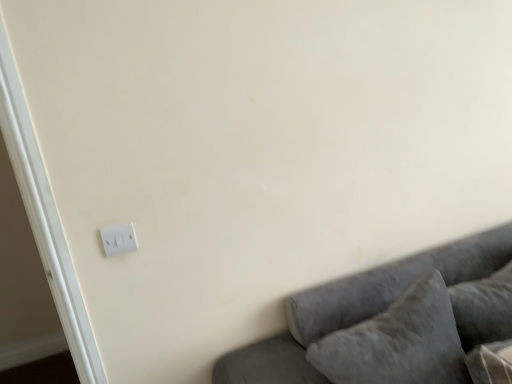
Question: Is velvety gray pillow at lower right, positioned as the second pillow in left-to-right order, in front of or behind white plastic light switch at lower left in the image?

Choices:
 (A) behind
 (B) front

Answer: (B)

Question: Would you say velvety gray pillow at lower right, the 1th pillow in the right-to-left sequence, is to the left or to the right of white plastic light switch at lower left in the picture?

Choices:
 (A) right
 (B) left

Answer: (A)

Question: Which object is the farthest from the velvet gray pillow at lower right, marked as the second pillow in a right-to-left arrangement?

Choices:
 (A) velvet gray couch at lower right
 (B) white plastic light switch at lower left
 (C) velvety gray pillow at lower right, positioned as the second pillow in left-to-right order

Answer: (B)

Question: Estimate the real-world distances between objects in this image. Which object is farther from the white plastic light switch at lower left?

Choices:
 (A) velvet gray couch at lower right
 (B) velvet gray pillow at lower right, which is the first pillow from left to right
 (C) velvety gray pillow at lower right, positioned as the second pillow in left-to-right order

Answer: (C)